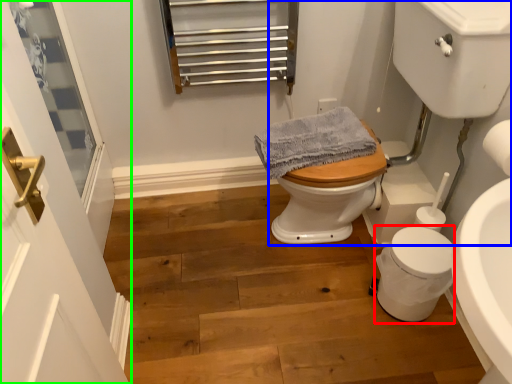
Question: Considering the real-world distances, which object is farthest from porcelain (highlighted by a red box)? sink (highlighted by a blue box) or screen door (highlighted by a green box)?

Choices:
 (A) sink
 (B) screen door

Answer: (B)